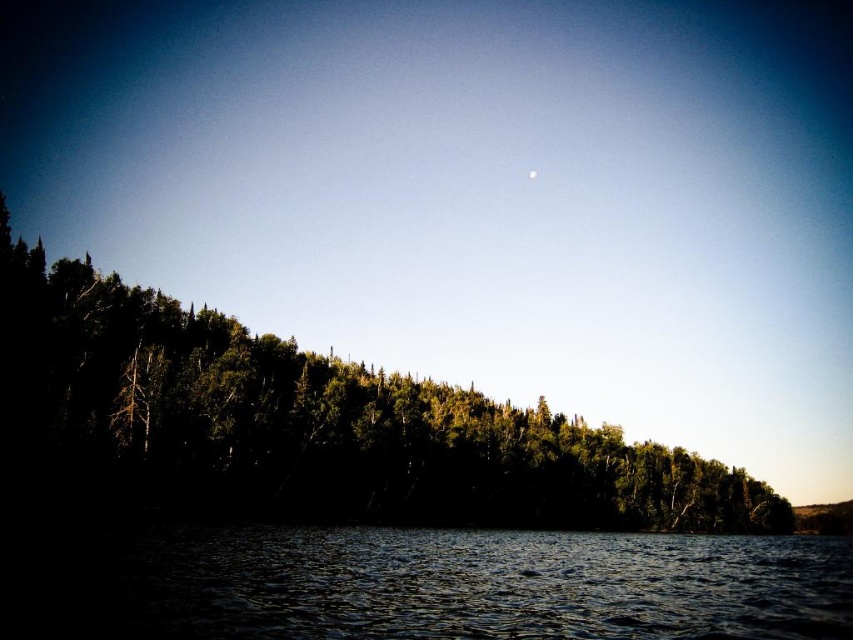
Is point (608, 436) farther from viewer compared to point (532, 170)?

No, it is in front of (532, 170).

Which is in front, point (228, 454) or point (531, 179)?

Point (228, 454)

Describe the element at coordinates (314, 422) in the screenshot. I see `green leafy trees at center` at that location.

The width and height of the screenshot is (853, 640). Identify the location of green leafy trees at center. (314, 422).

Which is in front, point (558, 573) or point (531, 172)?

Point (558, 573) is in front.

Can you confirm if dark blue water at lower center is positioned to the left of white glossy moon at upper center?

Correct, you'll find dark blue water at lower center to the left of white glossy moon at upper center.

Is point (614, 625) positioned before point (537, 173)?

Yes, it is in front of point (537, 173).

I want to click on dark blue water at lower center, so click(479, 584).

Is the position of green leafy trees at center less distant than that of dark blue water at lower center?

That is False.

Is point (3, 269) positioned in front of point (778, 538)?

Yes, it is.

Is point (310, 416) in front of point (724, 570)?

That is False.

Where is `green leafy trees at center`? green leafy trees at center is located at coordinates (314, 422).